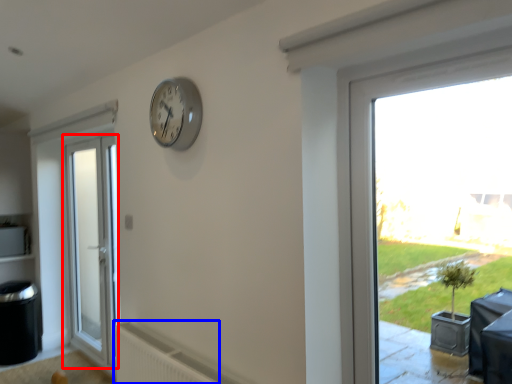
Question: Among these objects, which one is farthest to the camera, door (highlighted by a red box) or radiator (highlighted by a blue box)?

Choices:
 (A) door
 (B) radiator

Answer: (A)